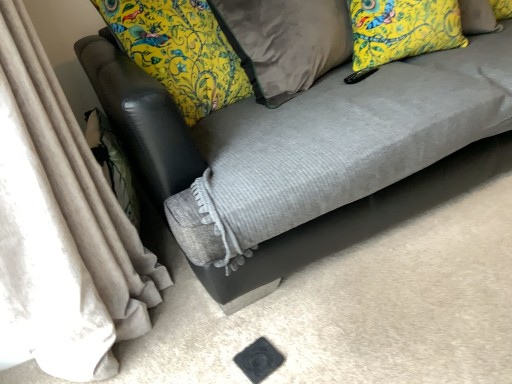
Question: Should I look upward or downward to see yellow floral fabric pillow at upper right, the 1th pillow viewed from the right?

Choices:
 (A) down
 (B) up

Answer: (B)

Question: Is velvet gray curtain at left not inside yellow floral fabric pillow at upper right, the 2th pillow positioned from the left?

Choices:
 (A) no
 (B) yes

Answer: (B)

Question: From a real-world perspective, is velvet gray curtain at left positioned under yellow floral fabric pillow at upper right, the 1th pillow viewed from the right, based on gravity?

Choices:
 (A) yes
 (B) no

Answer: (A)

Question: Could yellow floral fabric pillow at upper right, the 2th pillow positioned from the left, be considered to be inside velvet gray curtain at left?

Choices:
 (A) no
 (B) yes

Answer: (A)

Question: Is velvet gray curtain at left wider than yellow floral fabric pillow at upper right, the 2th pillow positioned from the left?

Choices:
 (A) no
 (B) yes

Answer: (B)

Question: From a real-world perspective, is velvet gray curtain at left physically above yellow floral fabric pillow at upper right, the 1th pillow viewed from the right?

Choices:
 (A) yes
 (B) no

Answer: (B)

Question: Considering the relative positions of velvet gray curtain at left and yellow floral fabric pillow at upper right, the 1th pillow viewed from the right, in the image provided, is velvet gray curtain at left behind yellow floral fabric pillow at upper right, the 1th pillow viewed from the right,?

Choices:
 (A) no
 (B) yes

Answer: (A)

Question: From a real-world perspective, does velvet gray curtain at left sit lower than textured gray couch at center?

Choices:
 (A) no
 (B) yes

Answer: (A)

Question: Is velvet gray curtain at left to the left of textured gray couch at center from the viewer's perspective?

Choices:
 (A) yes
 (B) no

Answer: (A)

Question: Considering the relative sizes of velvet gray curtain at left and textured gray couch at center in the image provided, is velvet gray curtain at left shorter than textured gray couch at center?

Choices:
 (A) yes
 (B) no

Answer: (B)

Question: Considering the relative sizes of velvet gray curtain at left and textured gray couch at center in the image provided, is velvet gray curtain at left taller than textured gray couch at center?

Choices:
 (A) yes
 (B) no

Answer: (A)

Question: Considering the relative sizes of velvet gray curtain at left and textured gray couch at center in the image provided, is velvet gray curtain at left wider than textured gray couch at center?

Choices:
 (A) yes
 (B) no

Answer: (B)

Question: Is velvet gray curtain at left thinner than textured gray couch at center?

Choices:
 (A) yes
 (B) no

Answer: (A)

Question: Can you confirm if velvet brown pillow at center, marked as the 1th pillow in a left-to-right arrangement, is bigger than textured gray couch at center?

Choices:
 (A) no
 (B) yes

Answer: (A)